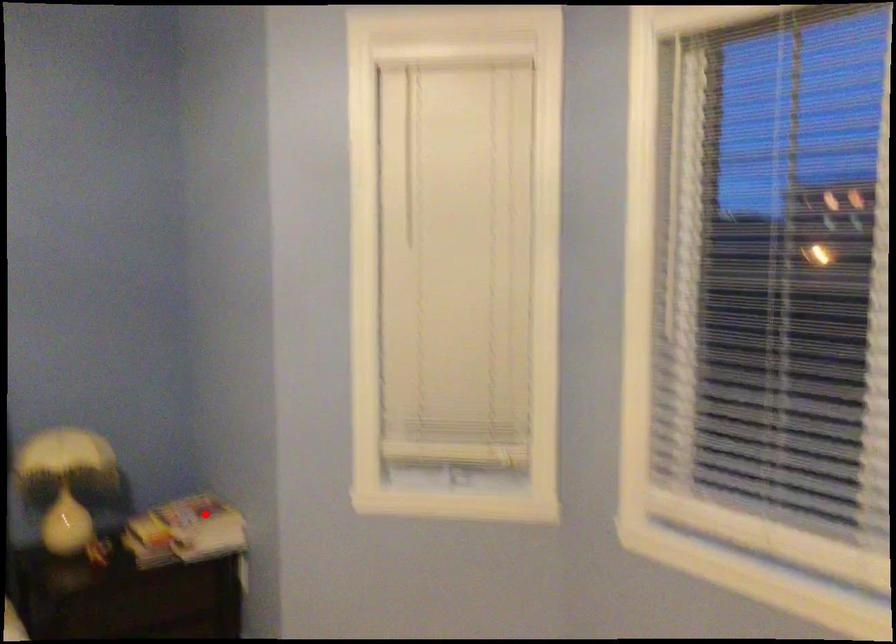
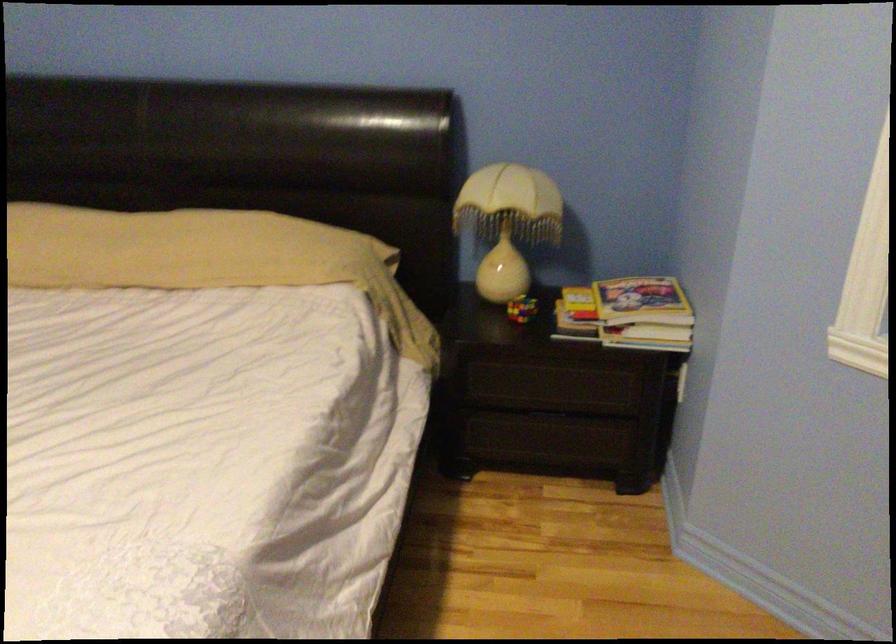
Locate, in the second image, the point that corresponds to the highlighted location in the first image.

(642, 301)